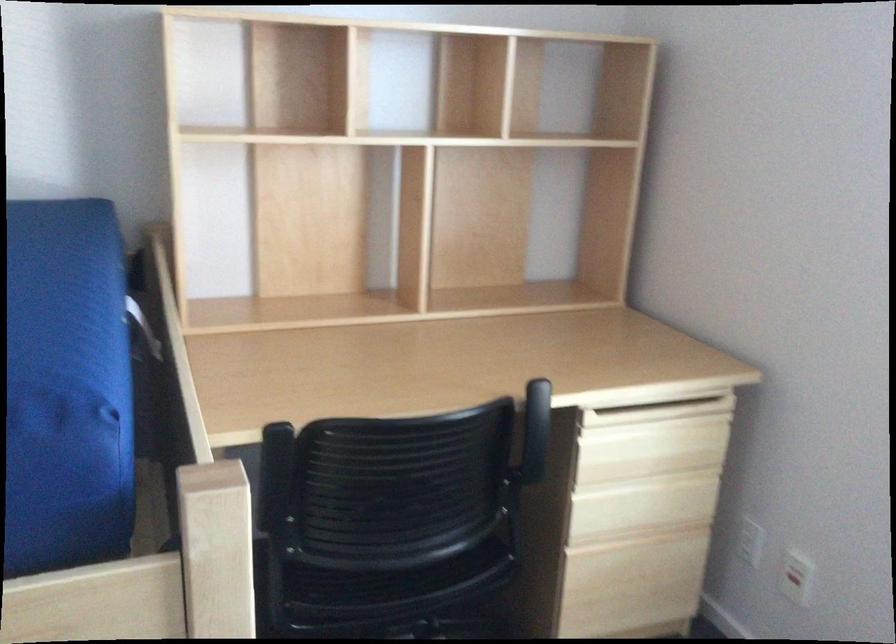
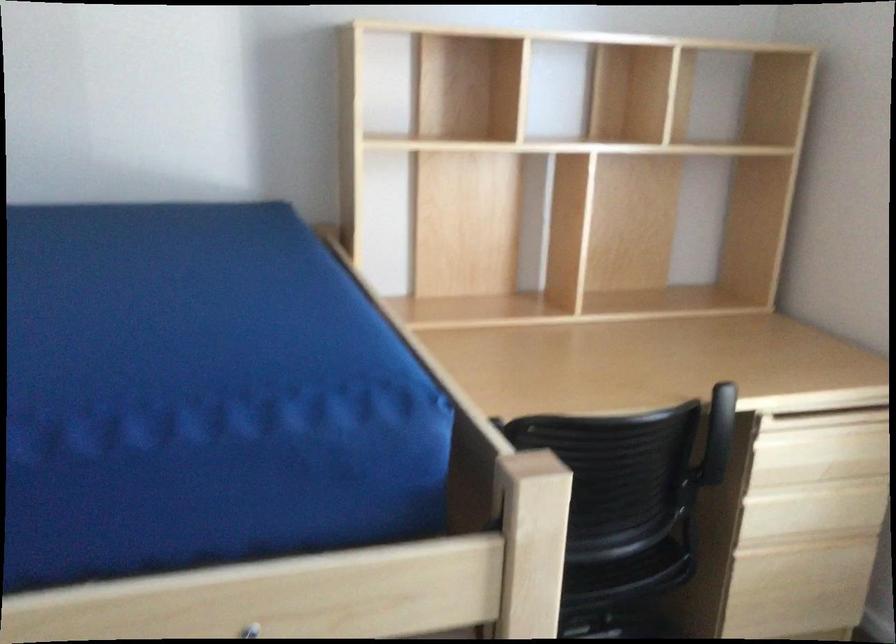
Question: I am providing you with two images of the same scene from different viewpoints. Please identify which objects are invisible in image2.

Choices:
 (A) wooden drawer pull
 (B) chair sitting surface
 (C) purple package
 (D) black chair armrest

Answer: (D)